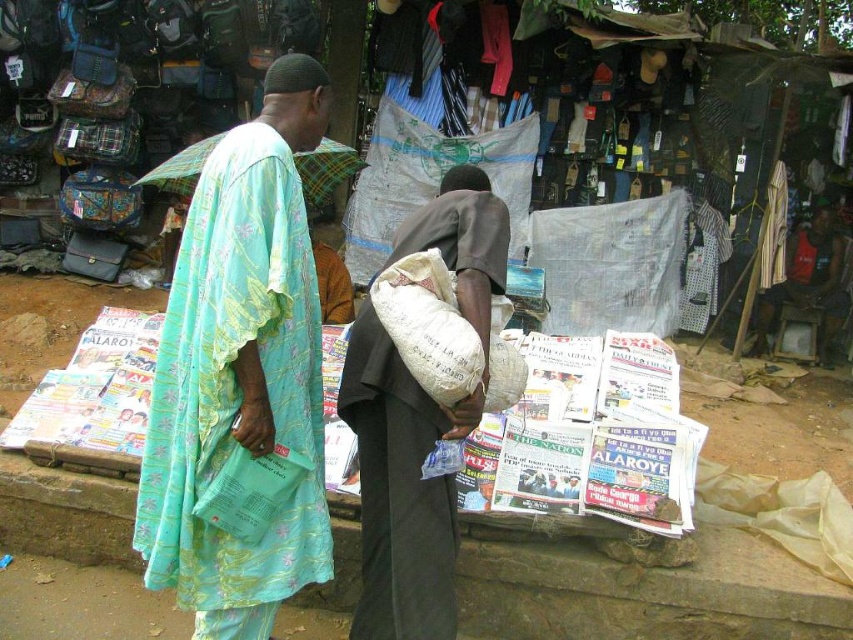
Is dark brown fabric bag at center taller than striped fabric shirt at center?

Indeed, dark brown fabric bag at center has a greater height compared to striped fabric shirt at center.

Who is more forward, (373, 448) or (697, 240)?

Point (373, 448) is in front.

The image size is (853, 640). I want to click on dark brown fabric bag at center, so click(401, 490).

Can you confirm if light blue floral fabric robe at left is positioned to the left of striped fabric shirt at center?

Correct, you'll find light blue floral fabric robe at left to the left of striped fabric shirt at center.

Does point (154, 432) come closer to viewer compared to point (699, 314)?

Yes, it is.

The width and height of the screenshot is (853, 640). What do you see at coordinates (236, 392) in the screenshot?
I see `light blue floral fabric robe at left` at bounding box center [236, 392].

The height and width of the screenshot is (640, 853). What are the coordinates of `light blue floral fabric robe at left` in the screenshot? It's located at (236, 392).

Is dark brown fabric bag at center closer to the viewer compared to reddish-brown fabric shirt at right?

That is True.

Where is `dark brown fabric bag at center`? This screenshot has width=853, height=640. dark brown fabric bag at center is located at coordinates (401, 490).

Who is more distant from viewer, [471,410] or [790,236]?

Point [790,236]

You are a GUI agent. You are given a task and a screenshot of the screen. Output one action in this format:
    pyautogui.click(x=<x>, y=<y>)
    Task: Click on the dark brown fabric bag at center
    The image size is (853, 640).
    Given the screenshot: What is the action you would take?
    [401, 490]